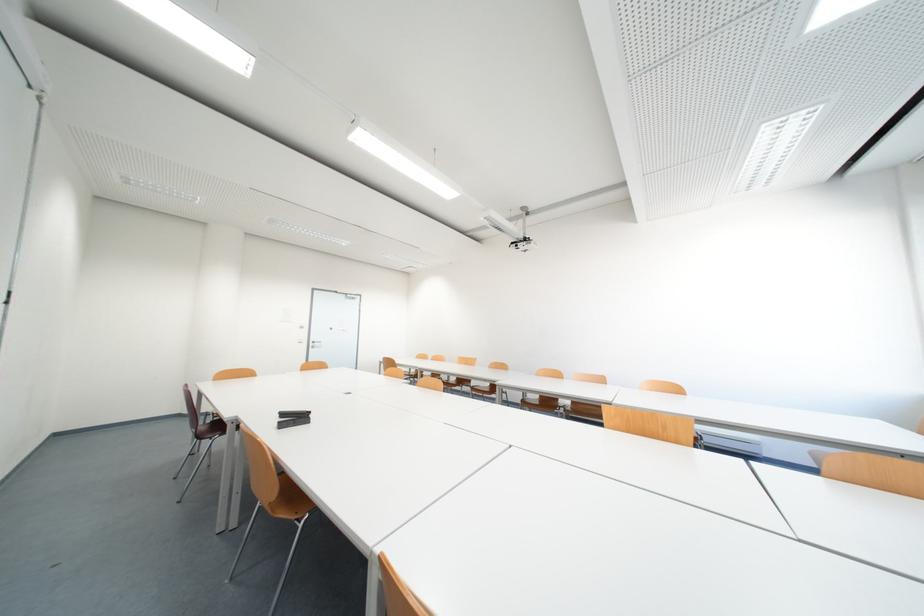
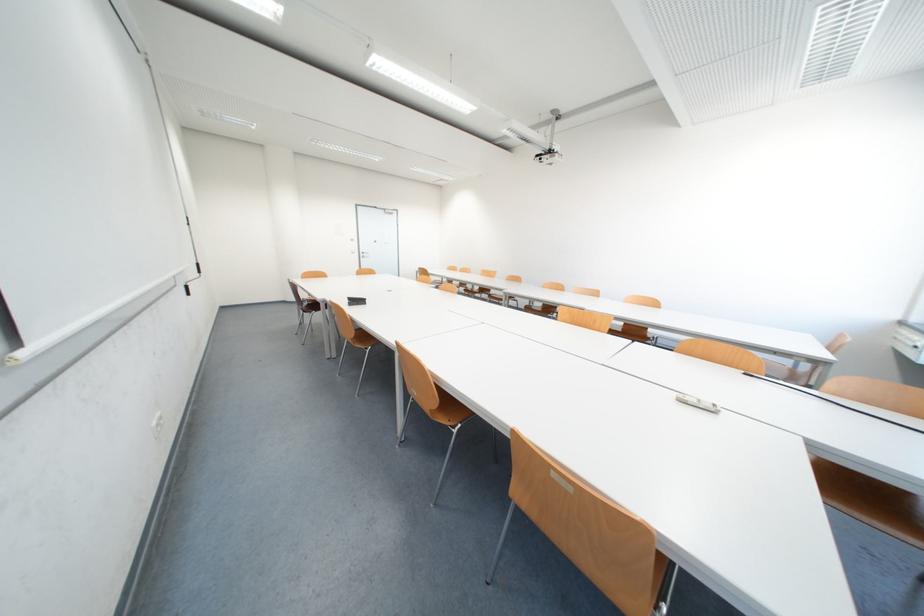
The point at (293, 416) is marked in the first image. Where is the corresponding point in the second image?

(359, 300)